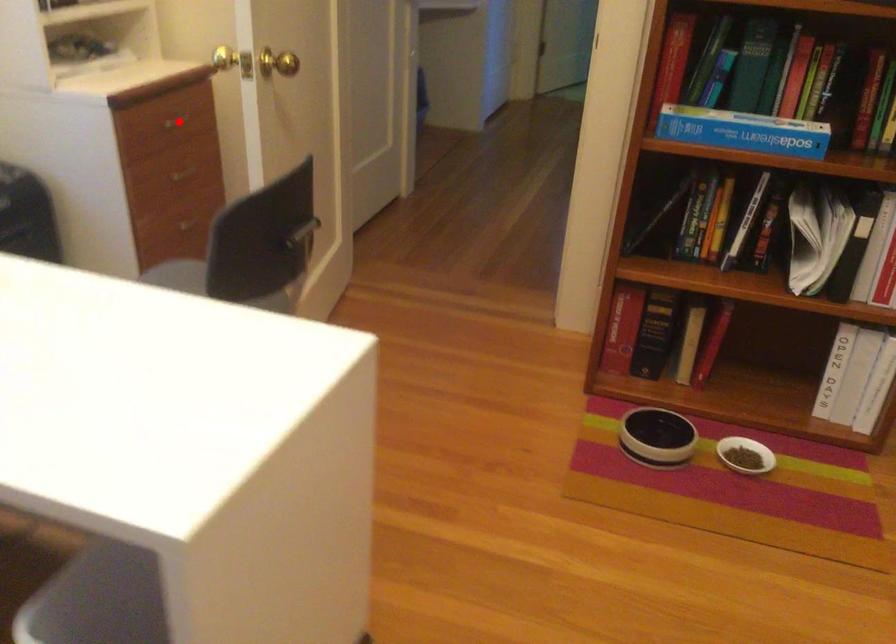
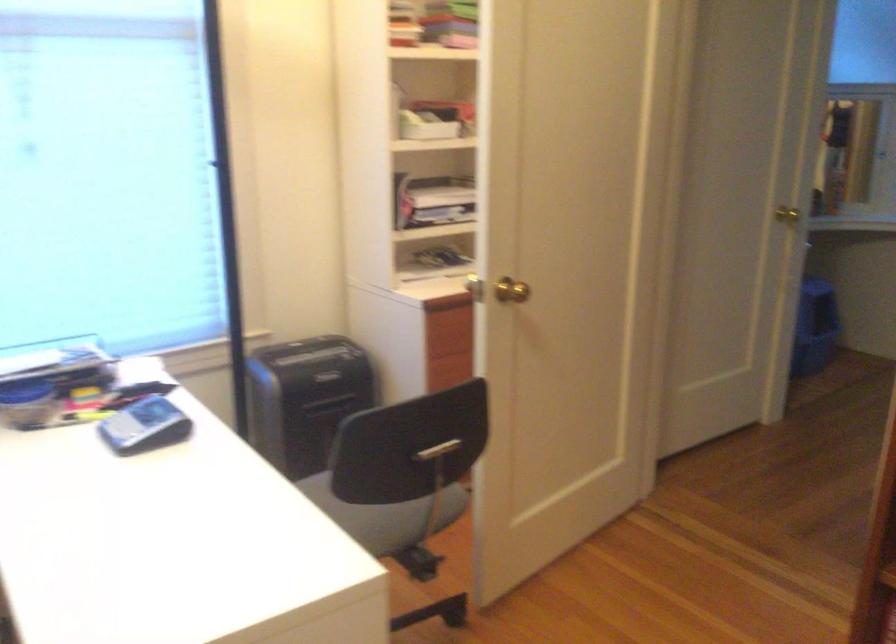
Question: I am providing you with two images of the same scene from different viewpoints. A red point is marked on the first image. At the location where the point appears in image 1, is it still visible in image 2?

Choices:
 (A) Yes
 (B) No

Answer: (B)